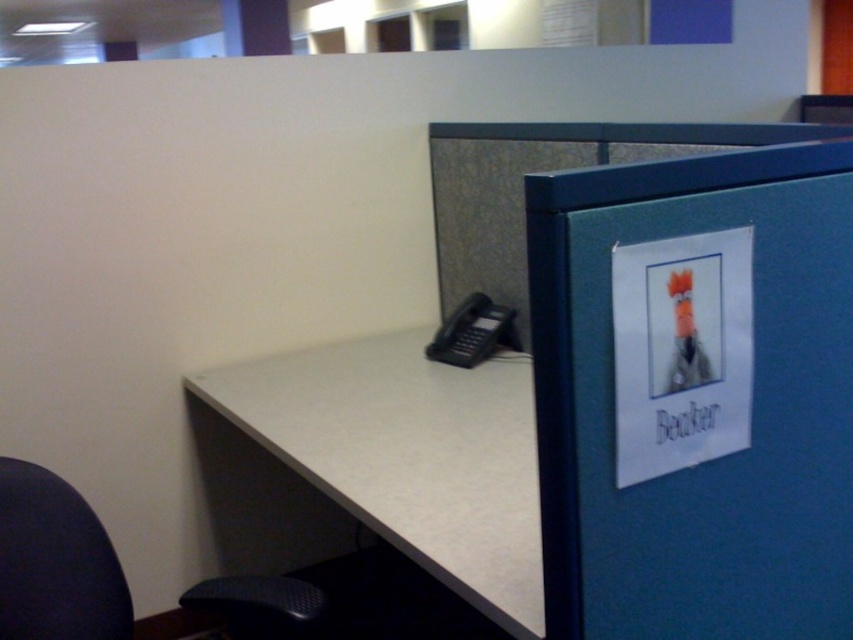
Can you confirm if blue felt file cabinet at right is taller than dark blue fabric swivel chair at lower left?

Correct, blue felt file cabinet at right is much taller as dark blue fabric swivel chair at lower left.

Can you confirm if blue felt file cabinet at right is positioned below dark blue fabric swivel chair at lower left?

Incorrect, blue felt file cabinet at right is not positioned below dark blue fabric swivel chair at lower left.

I want to click on blue felt file cabinet at right, so click(695, 394).

Locate an element on the screen. The image size is (853, 640). blue felt file cabinet at right is located at coordinates (695, 394).

Is blue felt file cabinet at right thinner than white laminate desk at center?

Indeed, blue felt file cabinet at right has a lesser width compared to white laminate desk at center.

Does point (799, 552) come in front of point (293, 451)?

That is True.

Where is `blue felt file cabinet at right`? This screenshot has width=853, height=640. blue felt file cabinet at right is located at coordinates (695, 394).

Does white laminate desk at center have a lesser width compared to dark blue fabric swivel chair at lower left?

In fact, white laminate desk at center might be wider than dark blue fabric swivel chair at lower left.

Find the location of a particular element. The height and width of the screenshot is (640, 853). white laminate desk at center is located at coordinates (409, 456).